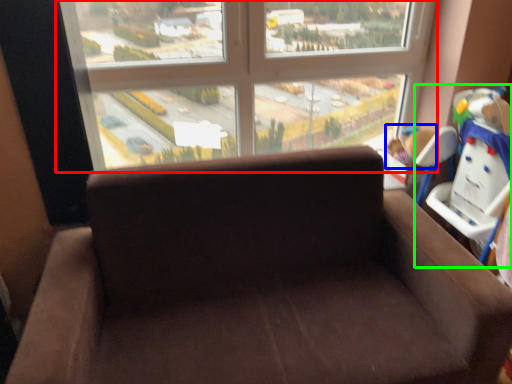
Question: Which object is positioned closest to window (highlighted by a red box)? Select from child (highlighted by a blue box) and baby carriage (highlighted by a green box).

Choices:
 (A) child
 (B) baby carriage

Answer: (A)